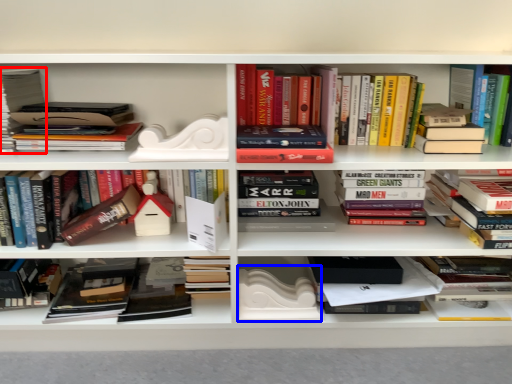
Question: Which of the following is the closest to the observer, book (highlighted by a red box) or paperback book (highlighted by a blue box)?

Choices:
 (A) book
 (B) paperback book

Answer: (A)